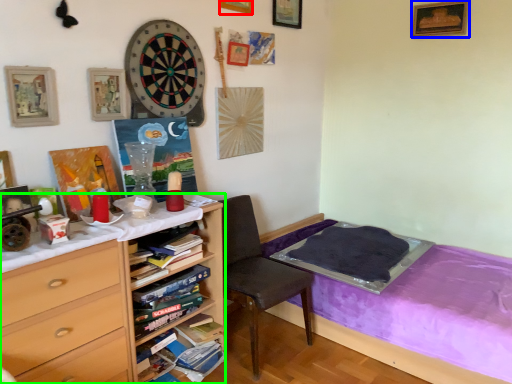
Question: Considering the real-world distances, which object is closest to picture frame (highlighted by a red box)? picture frame (highlighted by a blue box) or desk (highlighted by a green box).

Choices:
 (A) picture frame
 (B) desk

Answer: (A)